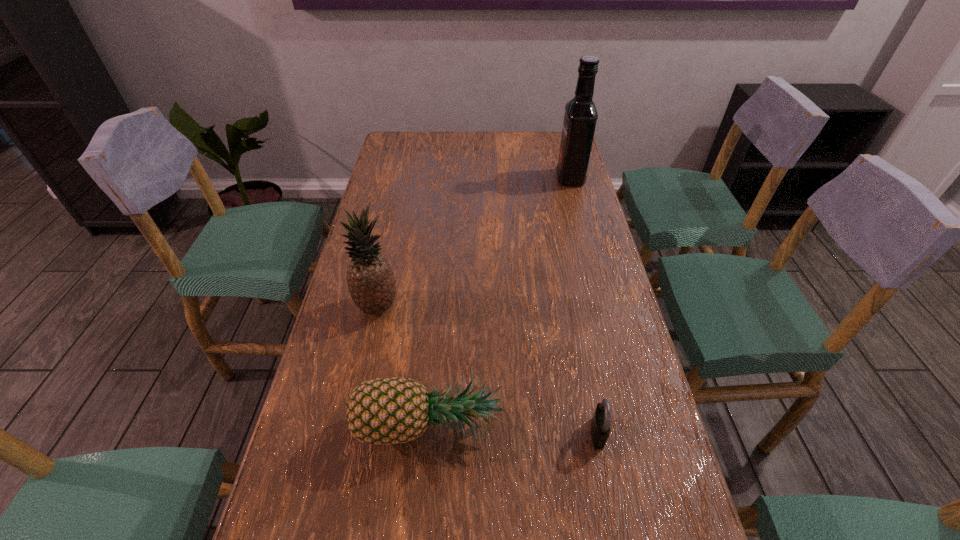
Where is `free point between the second farthest object and the shorter pineapple`? Image resolution: width=960 pixels, height=540 pixels. free point between the second farthest object and the shorter pineapple is located at coordinates click(403, 366).

The width and height of the screenshot is (960, 540). I want to click on free space between the third object from left to right and the second shortest object, so click(x=514, y=429).

This screenshot has width=960, height=540. Identify the location of vacant space that's between the third nearest object and the tallest object. (474, 242).

Identify the location of empty space between the farthest object and the shorter pineapple. (499, 301).

I want to click on vacant area between the shortest object and the third tallest object, so click(514, 429).

You are a GUI agent. You are given a task and a screenshot of the screen. Output one action in this format:
    pyautogui.click(x=<x>, y=<y>)
    Task: Click on the free space between the nearer pineapple and the taller pineapple
    Image resolution: width=960 pixels, height=540 pixels.
    Given the screenshot: What is the action you would take?
    pyautogui.click(x=403, y=366)

This screenshot has width=960, height=540. I want to click on free spot between the farthest object and the second object from right to left, so click(584, 306).

You are a GUI agent. You are given a task and a screenshot of the screen. Output one action in this format:
    pyautogui.click(x=<x>, y=<y>)
    Task: Click on the vacant area that lies between the second tallest object and the farthest object
    The image size is (960, 540).
    Given the screenshot: What is the action you would take?
    pyautogui.click(x=474, y=242)

This screenshot has height=540, width=960. I want to click on blank region between the nearer pineapple and the padlock, so click(x=514, y=429).

Locate an element on the screen. The width and height of the screenshot is (960, 540). object that ranks as the second closest to the nearer pineapple is located at coordinates (370, 279).